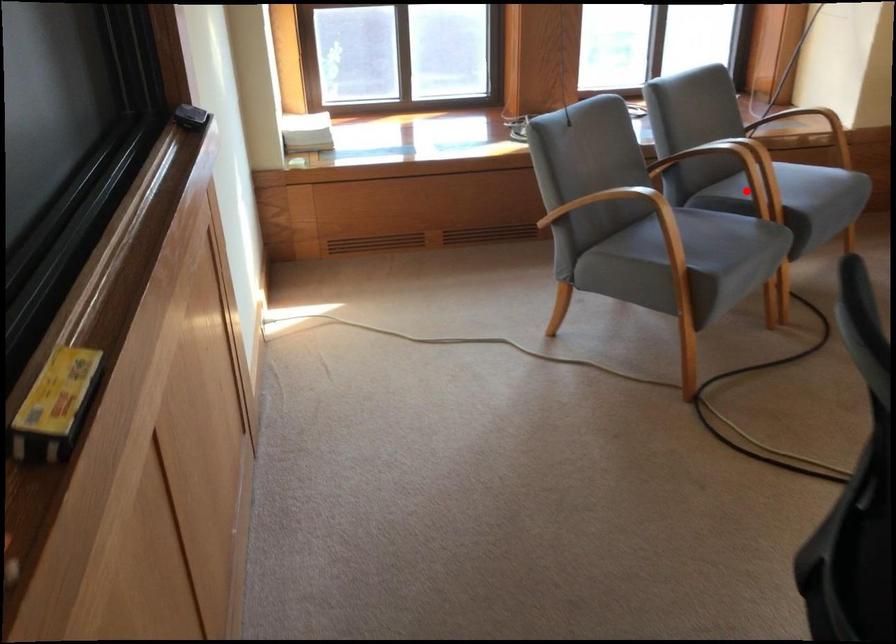
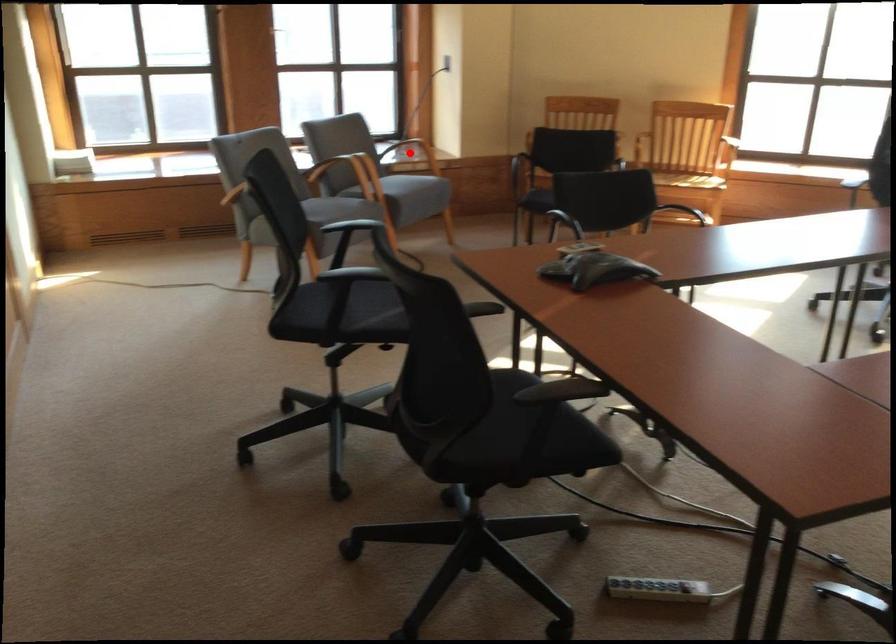
I am providing you with two images of the same scene from different viewpoints. A red point is marked on the first image and another point is marked on the second image. Do the highlighted points in image1 and image2 indicate the same real-world spot?

No